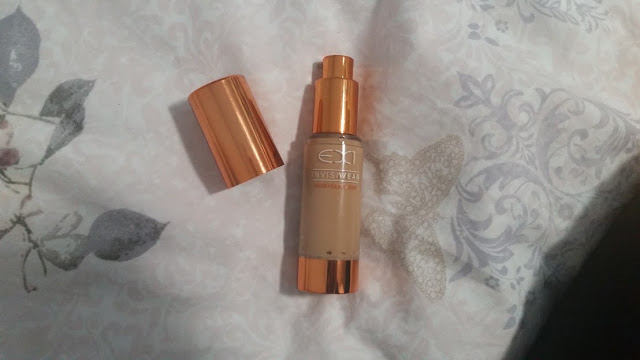
Identify the location of white cloth. This screenshot has width=640, height=360. (416, 323).